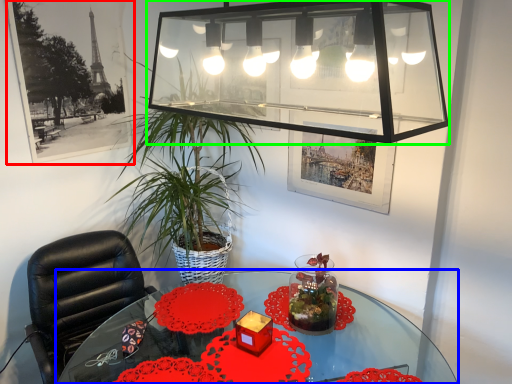
Question: Which object is positioned farthest from picture frame (highlighted by a red box)? Select from table (highlighted by a blue box) and glass box (highlighted by a green box).

Choices:
 (A) table
 (B) glass box

Answer: (A)